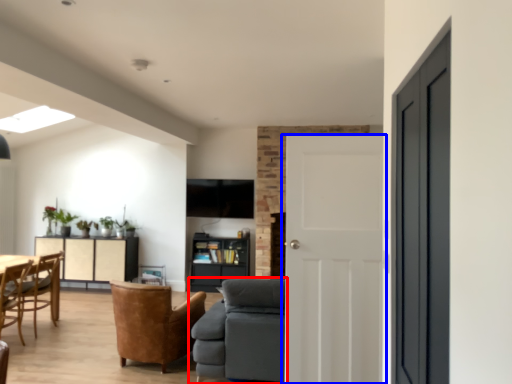
Question: Which of the following is the closest to the observer, studio couch (highlighted by a red box) or door (highlighted by a blue box)?

Choices:
 (A) studio couch
 (B) door

Answer: (B)